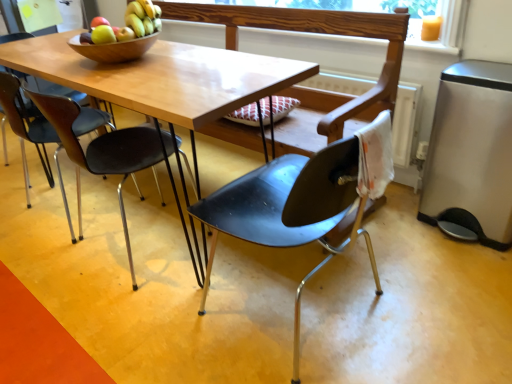
This screenshot has height=384, width=512. I want to click on blank space to the left of matte black chair at center, which is the 3th chair in left-to-right order, so click(x=159, y=333).